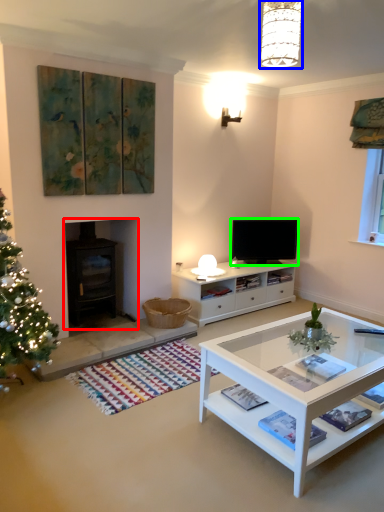
Question: Which is farther away from fireplace (highlighted by a red box)? lamp (highlighted by a blue box) or television (highlighted by a green box)?

Choices:
 (A) lamp
 (B) television

Answer: (A)